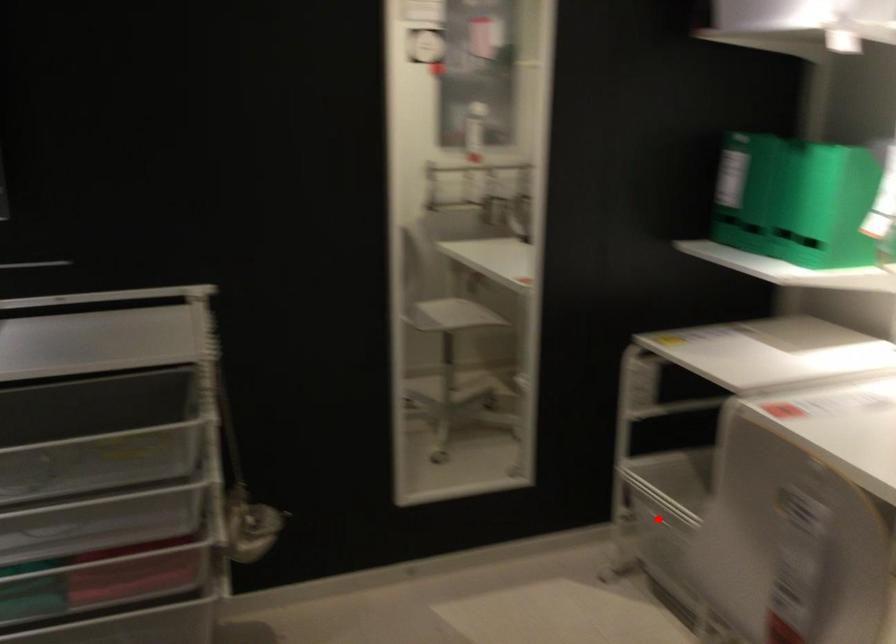
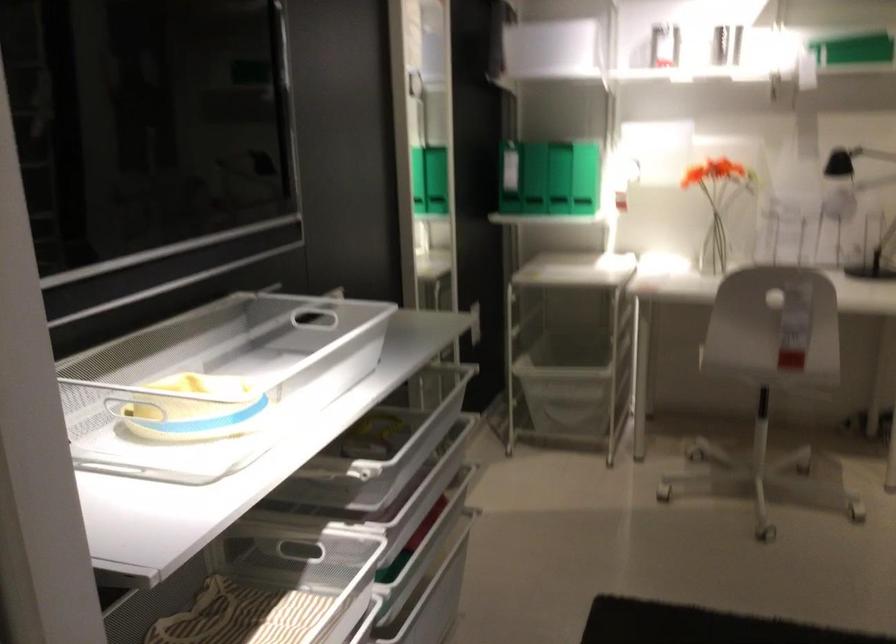
Question: I am providing you with two images of the same scene from different viewpoints. Given a red point in image1, look at the same physical point in image2. Is it:

Choices:
 (A) Closer to the viewpoint
 (B) Farther from the viewpoint

Answer: (B)